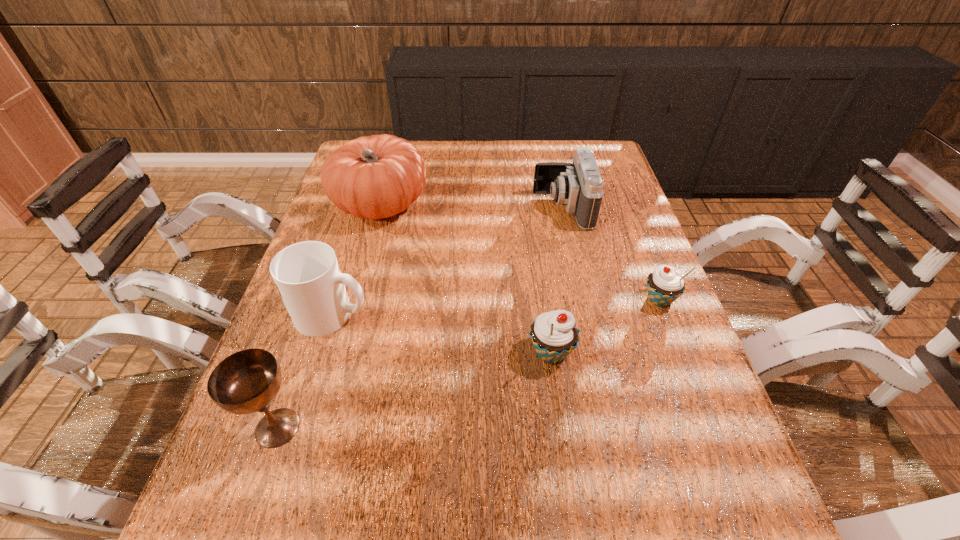
Image resolution: width=960 pixels, height=540 pixels. I want to click on blank area in the image that satisfies the following two spatial constraints: 1. on the front side of the pumpkin; 2. on the right side of the farther cupcake, so click(x=355, y=300).

The width and height of the screenshot is (960, 540). Identify the location of free spot that satisfies the following two spatial constraints: 1. at the front of the camera with an open lens cover; 2. on the left side of the right cupcake. (583, 300).

Find the location of `free space that satisfies the following two spatial constraints: 1. on the front side of the pumpkin; 2. on the handle side of the mug`. free space that satisfies the following two spatial constraints: 1. on the front side of the pumpkin; 2. on the handle side of the mug is located at coordinates (351, 314).